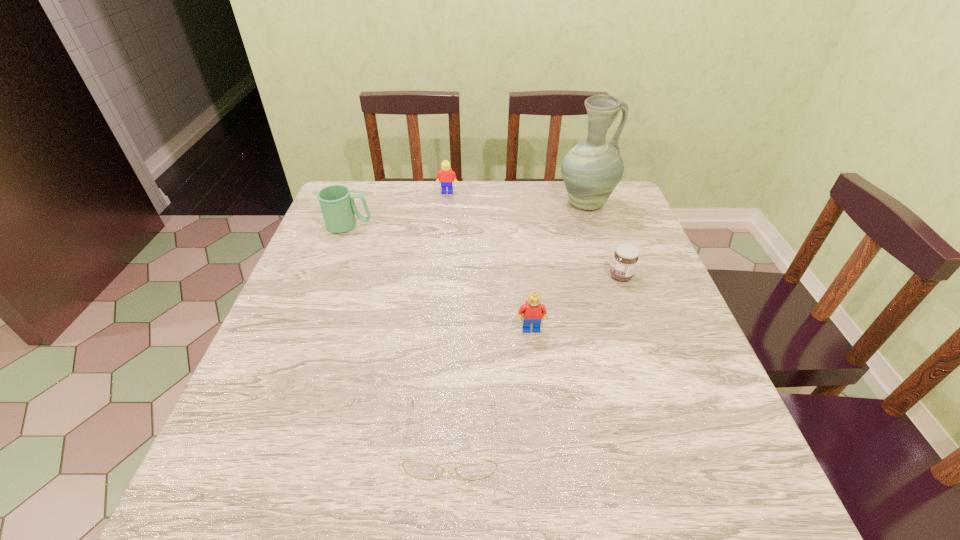
Find the location of `free space located 0.220m on the side of the leftmost object with the handle`. free space located 0.220m on the side of the leftmost object with the handle is located at coordinates (449, 226).

Where is `vacant space located 0.130m on the face of the right Lego`? Image resolution: width=960 pixels, height=540 pixels. vacant space located 0.130m on the face of the right Lego is located at coordinates (538, 384).

At what (x,y) coordinates should I click in order to perform the action: click on vacant area situated 0.340m on the front label of the second shortest object. Please return your answer as a coordinate pair (x, y). Looking at the image, I should click on (471, 276).

Where is `free location located on the front label of the second shortest object`? The height and width of the screenshot is (540, 960). free location located on the front label of the second shortest object is located at coordinates (495, 276).

At what (x,y) coordinates should I click in order to perform the action: click on free space located on the front label of the second shortest object. Please return your answer as a coordinate pair (x, y). This screenshot has width=960, height=540. Looking at the image, I should click on (520, 276).

Locate an element on the screen. pitcher positioned at the far edge is located at coordinates (591, 170).

Identify the location of Lego that is at the far edge. (446, 175).

You are a GUI agent. You are given a task and a screenshot of the screen. Output one action in this format:
    pyautogui.click(x=<x>, y=<y>)
    Task: Click on the mug present at the far edge
    
    Given the screenshot: What is the action you would take?
    pyautogui.click(x=338, y=208)

You are a GUI agent. You are given a task and a screenshot of the screen. Output one action in this format:
    pyautogui.click(x=<x>, y=<y>)
    Task: Click on the object that is at the near edge
    The width and height of the screenshot is (960, 540).
    Given the screenshot: What is the action you would take?
    pyautogui.click(x=480, y=470)

Where is `object located at the left edge`? The image size is (960, 540). object located at the left edge is located at coordinates (338, 208).